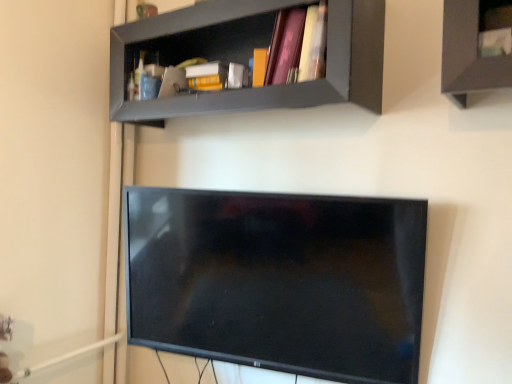
Image resolution: width=512 pixels, height=384 pixels. What do you see at coordinates (298, 46) in the screenshot?
I see `pink matte book at upper center` at bounding box center [298, 46].

Locate an element on the screen. Image resolution: width=512 pixels, height=384 pixels. pink matte book at upper center is located at coordinates (298, 46).

This screenshot has width=512, height=384. Describe the element at coordinates (248, 57) in the screenshot. I see `matte gray shelf at upper center` at that location.

You are a GUI agent. You are given a task and a screenshot of the screen. Output one action in this format:
    pyautogui.click(x=<x>, y=<y>)
    Task: Click on the matte gray shelf at upper center
    This screenshot has height=384, width=512.
    Given the screenshot: What is the action you would take?
    pyautogui.click(x=248, y=57)

Locate an element on the screen. Image resolution: width=512 pixels, height=384 pixels. pink matte book at upper center is located at coordinates (298, 46).

Looking at this image, which is more to the right, pink matte book at upper center or matte gray shelf at upper center?

pink matte book at upper center.

Considering their positions, is pink matte book at upper center located in front of or behind matte gray shelf at upper center?

pink matte book at upper center is behind matte gray shelf at upper center.

Does point (275, 62) lie behind point (330, 55)?

That is True.

From the image's perspective, is pink matte book at upper center under matte gray shelf at upper center?

Yes, from the image's perspective, pink matte book at upper center is beneath matte gray shelf at upper center.

From a real-world perspective, which object stands above the other?

pink matte book at upper center.

Is pink matte book at upper center wider than matte gray shelf at upper center?

No, pink matte book at upper center is not wider than matte gray shelf at upper center.

Is pink matte book at upper center shorter than matte gray shelf at upper center?

Yes.

Which of these two, pink matte book at upper center or matte gray shelf at upper center, is bigger?

With larger size is matte gray shelf at upper center.

Can matte gray shelf at upper center be found inside pink matte book at upper center?

No, matte gray shelf at upper center is not inside pink matte book at upper center.

From the picture: Would you consider pink matte book at upper center to be distant from matte gray shelf at upper center?

No.

Could you tell me if pink matte book at upper center is facing matte gray shelf at upper center?

Yes.

At what (x,y) coordinates should I click in order to perform the action: click on shelf in front of the pink matte book at upper center. Please return your answer as a coordinate pair (x, y). Looking at the image, I should click on (248, 57).

Considering the positions of objects matte gray shelf at upper center and pink matte book at upper center in the image provided, who is more to the right, matte gray shelf at upper center or pink matte book at upper center?

From the viewer's perspective, pink matte book at upper center appears more on the right side.

Is matte gray shelf at upper center further to the viewer compared to pink matte book at upper center?

No, matte gray shelf at upper center is closer to the camera.

Considering the points (351, 44) and (300, 40), which point is in front, point (351, 44) or point (300, 40)?

The point (351, 44) is closer to the camera.

From the image's perspective, relative to pink matte book at upper center, is matte gray shelf at upper center above or below?

matte gray shelf at upper center is above pink matte book at upper center.

From a real-world perspective, who is located lower, matte gray shelf at upper center or pink matte book at upper center?

matte gray shelf at upper center.

Does matte gray shelf at upper center have a lesser width compared to pink matte book at upper center?

Incorrect, the width of matte gray shelf at upper center is not less than that of pink matte book at upper center.

Considering the sizes of objects matte gray shelf at upper center and pink matte book at upper center in the image provided, who is shorter, matte gray shelf at upper center or pink matte book at upper center?

pink matte book at upper center.

Which of these two, matte gray shelf at upper center or pink matte book at upper center, is smaller?

With smaller size is pink matte book at upper center.

Is pink matte book at upper center located within matte gray shelf at upper center?

Yes.

Is matte gray shelf at upper center with pink matte book at upper center?

matte gray shelf at upper center and pink matte book at upper center are not in contact.

Consider the image. Is matte gray shelf at upper center oriented towards pink matte book at upper center?

Yes, matte gray shelf at upper center is turned towards pink matte book at upper center.

Where is `shelf above the pink matte book at upper center (from the image's perspective)`? Image resolution: width=512 pixels, height=384 pixels. shelf above the pink matte book at upper center (from the image's perspective) is located at coordinates (248, 57).

In order to click on book located behind the matte gray shelf at upper center in this screenshot , I will do (x=298, y=46).

Identify the location of shelf below the pink matte book at upper center (from a real-world perspective). The image size is (512, 384). click(248, 57).